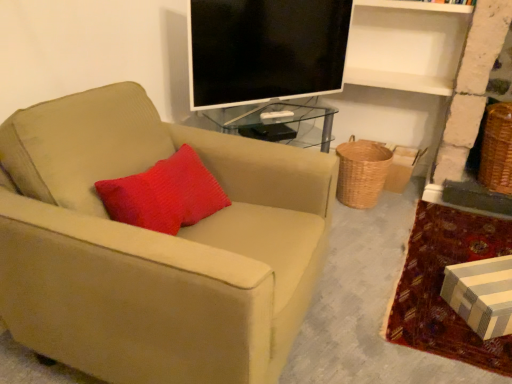
Locate an element on the screen. vacant area in front of woven brown basket at lower right, the first basket viewed from the left is located at coordinates (368, 219).